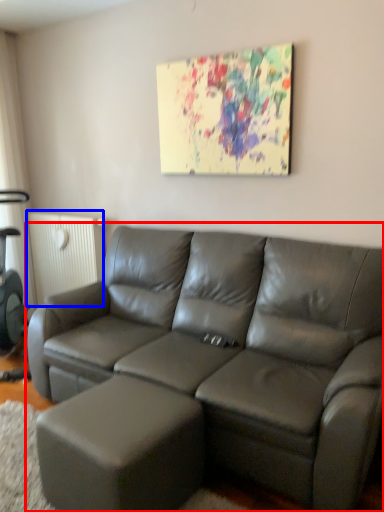
Question: Which of the following is the farthest to the observer, studio couch (highlighted by a red box) or radiator (highlighted by a blue box)?

Choices:
 (A) studio couch
 (B) radiator

Answer: (B)